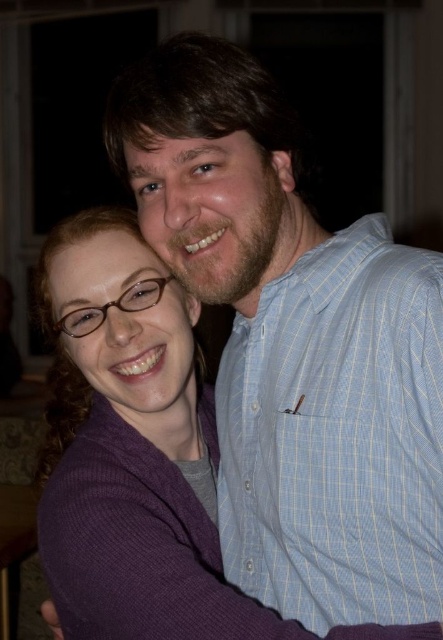
Question: Which object is farther from the camera taking this photo?

Choices:
 (A) blue plaid shirt at center
 (B) light blue striped shirt at center

Answer: (A)

Question: Can you confirm if blue plaid shirt at center is positioned below light blue striped shirt at center?

Choices:
 (A) yes
 (B) no

Answer: (B)

Question: Which of the following is the closest to the observer?

Choices:
 (A) (226, 506)
 (B) (228, 506)

Answer: (B)

Question: Does blue plaid shirt at center appear on the right side of light blue striped shirt at center?

Choices:
 (A) no
 (B) yes

Answer: (A)

Question: Does blue plaid shirt at center appear over light blue striped shirt at center?

Choices:
 (A) no
 (B) yes

Answer: (B)